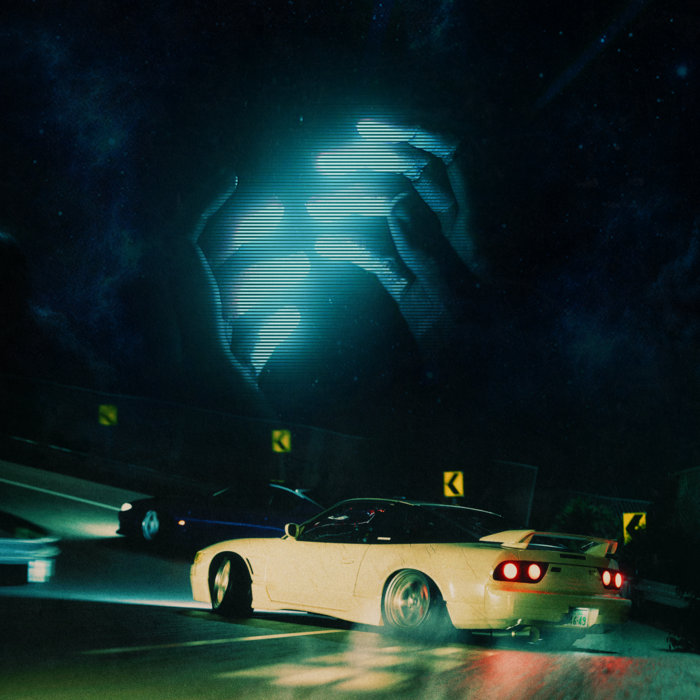
Where is `metal divider`? metal divider is located at coordinates (36, 547).